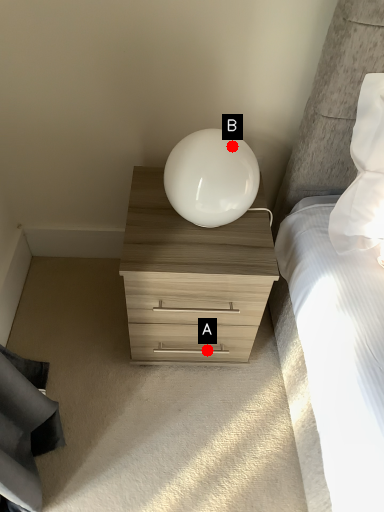
Question: Two points are circled on the image, labeled by A and B beside each circle. Which point is further to the camera?

Choices:
 (A) A is further
 (B) B is further

Answer: (A)